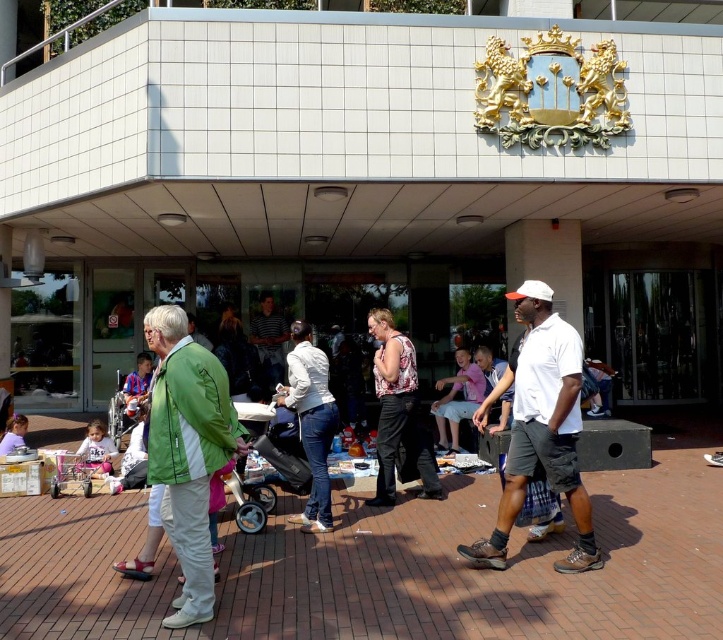
Question: Does printed fabric blouse at center have a greater width compared to matte blue shirt at lower left?

Choices:
 (A) no
 (B) yes

Answer: (A)

Question: Which of these objects is positioned closest to the light purple shirt at lower left?

Choices:
 (A) pink cotton shirt at center
 (B) printed fabric blouse at center
 (C) white matte jacket at center
 (D) brick pavement at center

Answer: (C)

Question: In this image, where is brick pavement at center located relative to green fabric jacket at center?

Choices:
 (A) below
 (B) above

Answer: (A)

Question: Can you confirm if white matte shirt at center is positioned below pink cotton shirt at center?

Choices:
 (A) yes
 (B) no

Answer: (B)

Question: Which of the following is the closest to the observer?

Choices:
 (A) (432, 492)
 (B) (469, 365)
 (C) (142, 388)
 (D) (557, 403)

Answer: (D)

Question: Which point appears farthest from the camera in this image?

Choices:
 (A) (385, 467)
 (B) (87, 452)

Answer: (B)